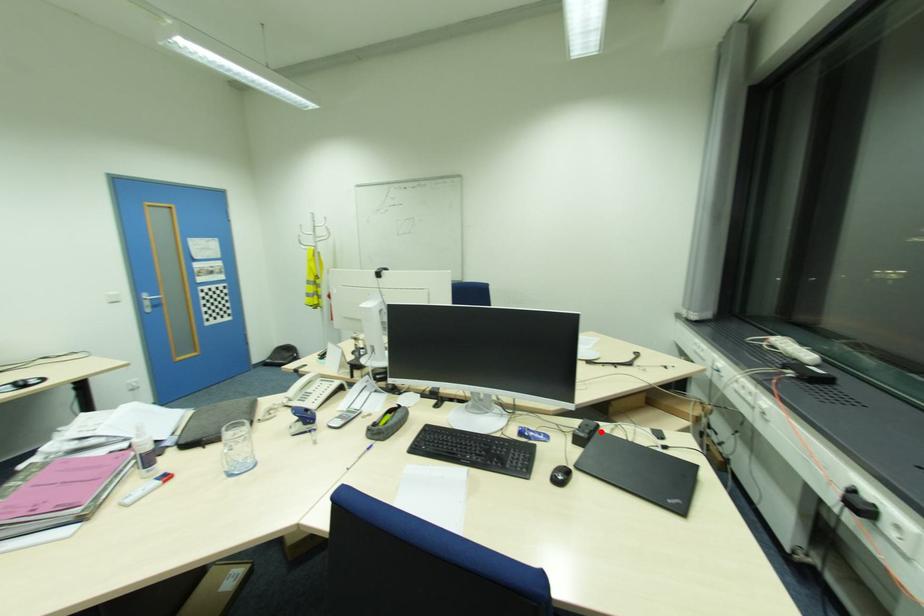
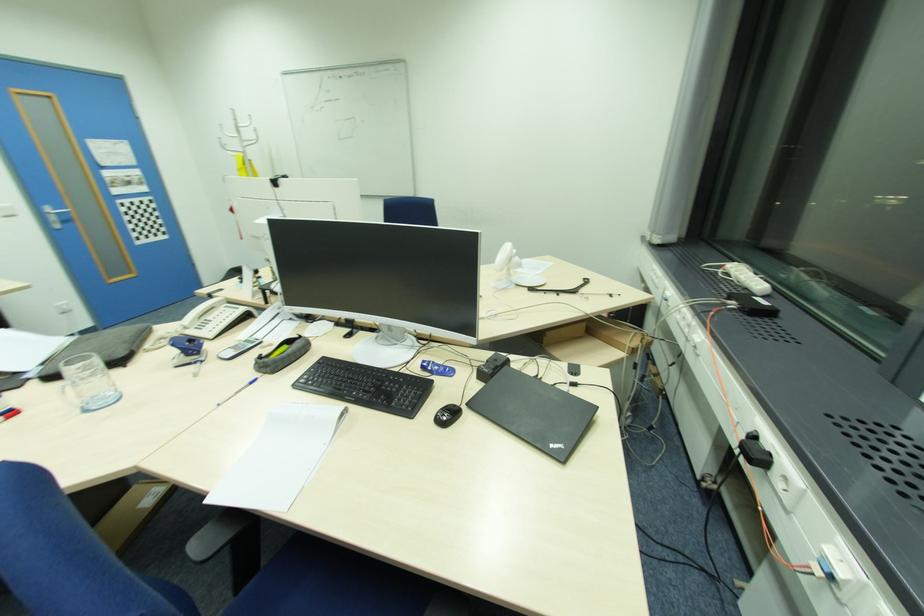
Find the pixel in the second image that matches the highlighted location in the first image.

(508, 367)